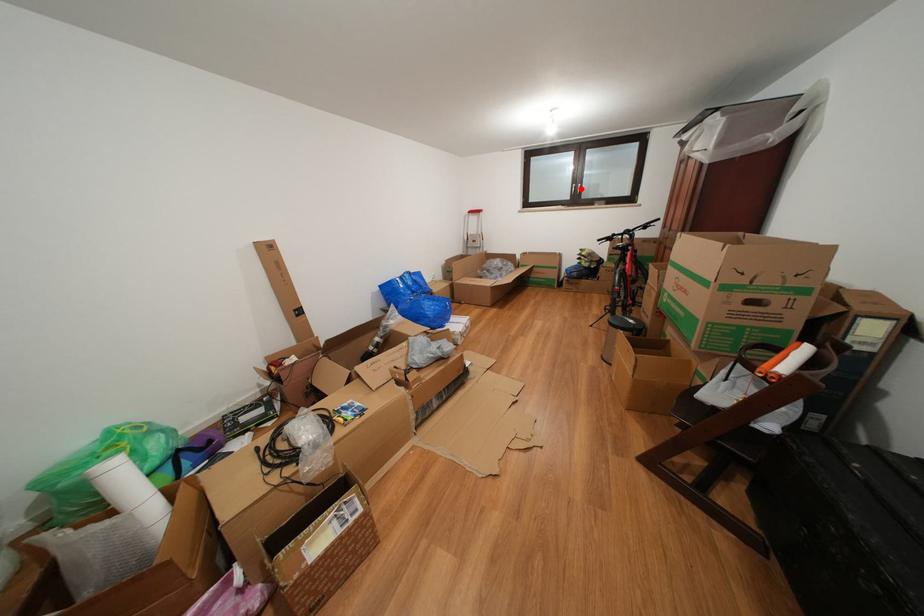
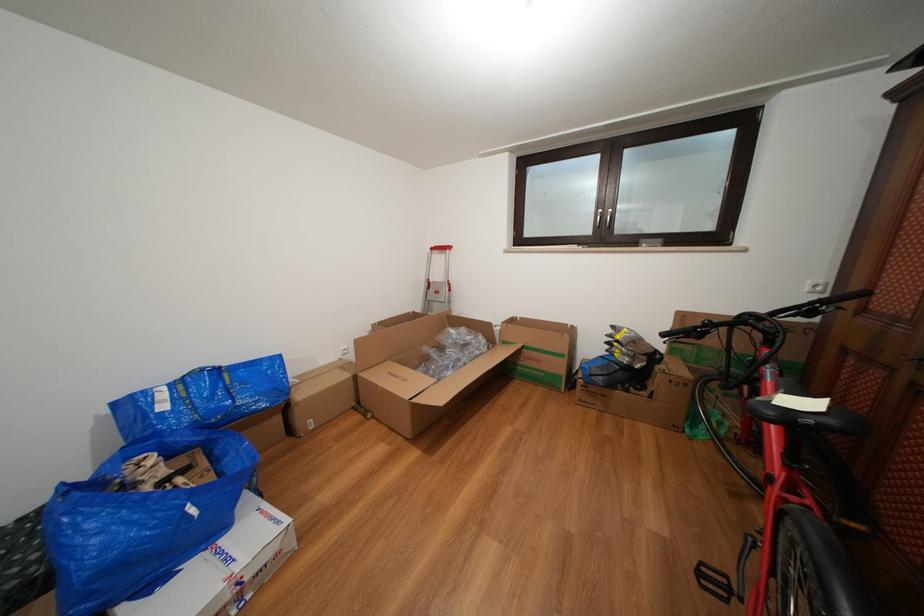
Question: A red point is marked in image1. In image2, is the corresponding 3D point closer to the camera or farther? Reply with the corresponding letter.

Choices:
 (A) The corresponding 3D point is closer.
 (B) The corresponding 3D point is farther.

Answer: (B)